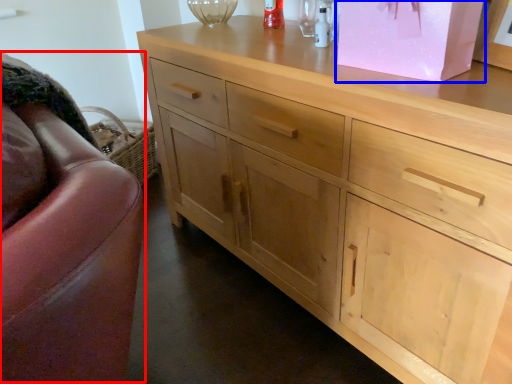
Question: Which object appears farthest to the camera in this image, swivel chair (highlighted by a red box) or cabinetry (highlighted by a blue box)?

Choices:
 (A) swivel chair
 (B) cabinetry

Answer: (B)